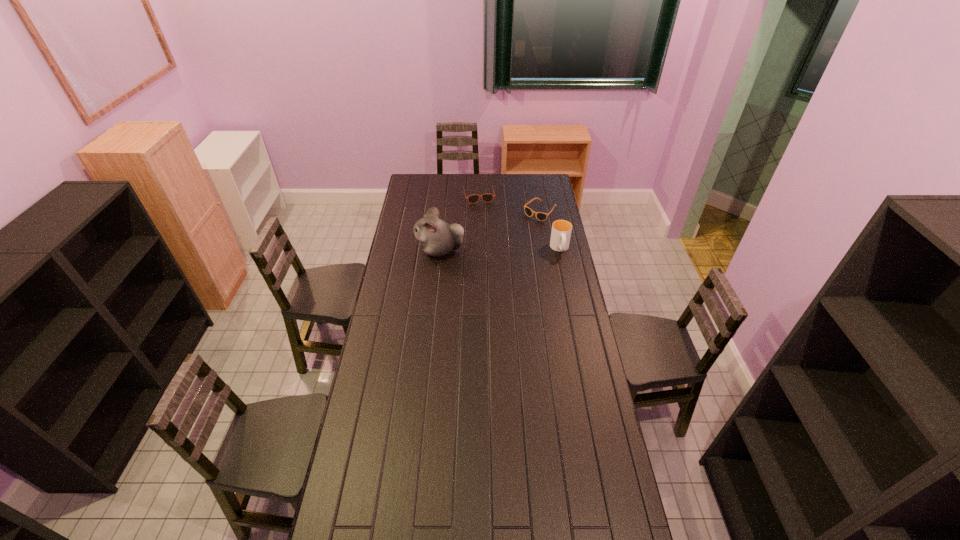
The width and height of the screenshot is (960, 540). I want to click on vacant space located 0.280m on the front-facing side of the right sunglasses, so click(506, 245).

I want to click on free point located on the front-facing side of the right sunglasses, so click(x=517, y=234).

Locate an element on the screen. This screenshot has height=540, width=960. free location located 0.130m on the front-facing side of the right sunglasses is located at coordinates (520, 232).

Identify the location of object that is at the far edge. This screenshot has height=540, width=960. (487, 197).

Locate an element on the screen. Image resolution: width=960 pixels, height=540 pixels. object that is at the left edge is located at coordinates (437, 238).

Where is `cup present at the right edge`? cup present at the right edge is located at coordinates (561, 229).

You are a GUI agent. You are given a task and a screenshot of the screen. Output one action in this format:
    pyautogui.click(x=<x>, y=<y>)
    Task: Click on the sunglasses that is at the right edge
    This screenshot has width=960, height=540.
    Given the screenshot: What is the action you would take?
    pyautogui.click(x=540, y=216)

Image resolution: width=960 pixels, height=540 pixels. Identify the location of vacant space at the far edge of the desktop. 435,179.

The image size is (960, 540). Find the location of `free space at the near edge of the desktop`. free space at the near edge of the desktop is located at coordinates (479, 528).

Find the location of a particular element. free point at the left edge is located at coordinates (390, 343).